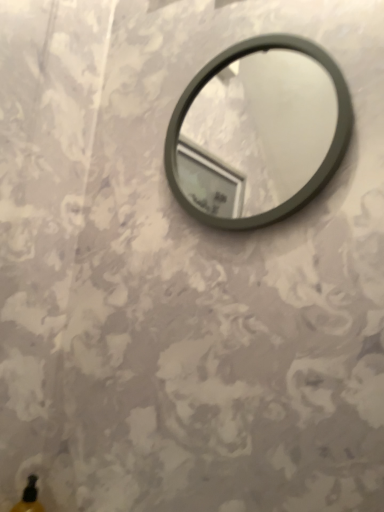
Where is `matte gray mirror at center`? This screenshot has width=384, height=512. matte gray mirror at center is located at coordinates (256, 133).

Describe the element at coordinates (256, 133) in the screenshot. The height and width of the screenshot is (512, 384). I see `matte gray mirror at center` at that location.

Describe the element at coordinates (29, 498) in the screenshot. The image size is (384, 512). I see `translucent yellow bottle at lower left` at that location.

Locate an element on the screen. The image size is (384, 512). translucent yellow bottle at lower left is located at coordinates (29, 498).

Identify the location of matte gray mirror at center. This screenshot has height=512, width=384. (256, 133).

Which object is positioned more to the right, matte gray mirror at center or translucent yellow bottle at lower left?

matte gray mirror at center is more to the right.

Between matte gray mirror at center and translucent yellow bottle at lower left, which one is positioned behind?

translucent yellow bottle at lower left.

Which is behind, point (266, 92) or point (27, 488)?

The point (266, 92) is farther.

Consider the image. From the image's perspective, would you say matte gray mirror at center is positioned over translucent yellow bottle at lower left?

Correct, matte gray mirror at center appears higher than translucent yellow bottle at lower left in the image.

From a real-world perspective, which object stands above the other?

matte gray mirror at center.

Is matte gray mirror at center wider or thinner than translucent yellow bottle at lower left?

Considering their sizes, matte gray mirror at center looks slimmer than translucent yellow bottle at lower left.

Can you confirm if matte gray mirror at center is shorter than translucent yellow bottle at lower left?

No.

Is matte gray mirror at center bigger or smaller than translucent yellow bottle at lower left?

Clearly, matte gray mirror at center is larger in size than translucent yellow bottle at lower left.

Would you say matte gray mirror at center is outside translucent yellow bottle at lower left?

matte gray mirror at center is positioned outside translucent yellow bottle at lower left.

Is there a large distance between matte gray mirror at center and translucent yellow bottle at lower left?

Absolutely, matte gray mirror at center is distant from translucent yellow bottle at lower left.

Looking at this image, is matte gray mirror at center oriented towards translucent yellow bottle at lower left?

No.

Can you tell me how much matte gray mirror at center and translucent yellow bottle at lower left differ in facing direction?

They differ by 89.8 degrees in their facing directions.

How distant is matte gray mirror at center from translucent yellow bottle at lower left?

A distance of 1.19 meters exists between matte gray mirror at center and translucent yellow bottle at lower left.

At what (x,y) coordinates should I click in order to perform the action: click on bottle beneath the matte gray mirror at center (from a real-world perspective). Please return your answer as a coordinate pair (x, y). The image size is (384, 512). Looking at the image, I should click on (29, 498).

In the scene shown: Can you confirm if translucent yellow bottle at lower left is positioned to the left of matte gray mirror at center?

Yes.

Considering the positions of objects translucent yellow bottle at lower left and matte gray mirror at center in the image provided, who is in front, translucent yellow bottle at lower left or matte gray mirror at center?

matte gray mirror at center is in front.

Is point (26, 486) closer or farther from the camera than point (252, 129)?

Point (26, 486) is positioned closer to the camera compared to point (252, 129).

From the image's perspective, would you say translucent yellow bottle at lower left is positioned over matte gray mirror at center?

No, from the image's perspective, translucent yellow bottle at lower left is not on top of matte gray mirror at center.

From a real-world perspective, is translucent yellow bottle at lower left positioned under matte gray mirror at center based on gravity?

Yes.

Considering the relative sizes of translucent yellow bottle at lower left and matte gray mirror at center in the image provided, is translucent yellow bottle at lower left thinner than matte gray mirror at center?

In fact, translucent yellow bottle at lower left might be wider than matte gray mirror at center.

Who is taller, translucent yellow bottle at lower left or matte gray mirror at center?

matte gray mirror at center.

Does translucent yellow bottle at lower left have a larger size compared to matte gray mirror at center?

No, translucent yellow bottle at lower left is not bigger than matte gray mirror at center.

Can matte gray mirror at center be found inside translucent yellow bottle at lower left?

No, matte gray mirror at center is not inside translucent yellow bottle at lower left.

Is translucent yellow bottle at lower left in contact with matte gray mirror at center?

No, translucent yellow bottle at lower left is not with matte gray mirror at center.

Does translucent yellow bottle at lower left turn towards matte gray mirror at center?

No, translucent yellow bottle at lower left does not turn towards matte gray mirror at center.

At what (x,y) coordinates should I click in order to perform the action: click on mirror in front of the translucent yellow bottle at lower left. Please return your answer as a coordinate pair (x, y). Looking at the image, I should click on (256, 133).

Locate an element on the screen. mirror above the translucent yellow bottle at lower left (from a real-world perspective) is located at coordinates (x=256, y=133).

Locate an element on the screen. mirror in front of the translucent yellow bottle at lower left is located at coordinates (256, 133).